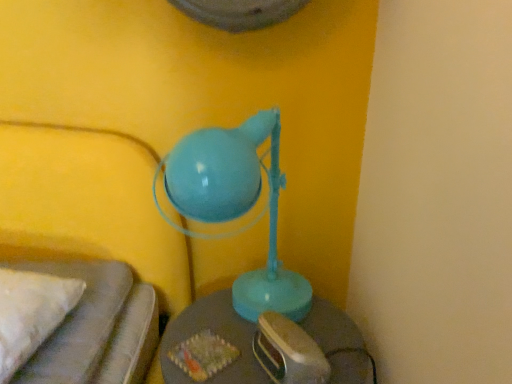
Find the location of a particular element. free point above matte gray table at center (from a real-world perspective) is located at coordinates (257, 327).